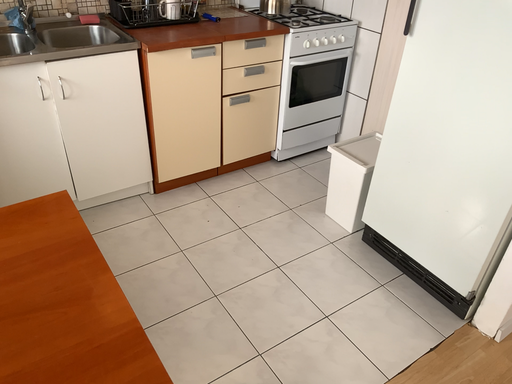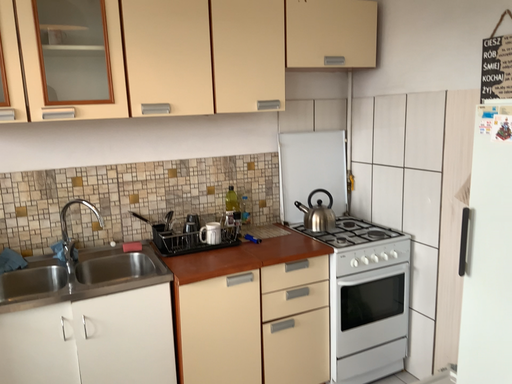
Question: Which way did the camera rotate in the video?

Choices:
 (A) rotated left
 (B) rotated right

Answer: (A)